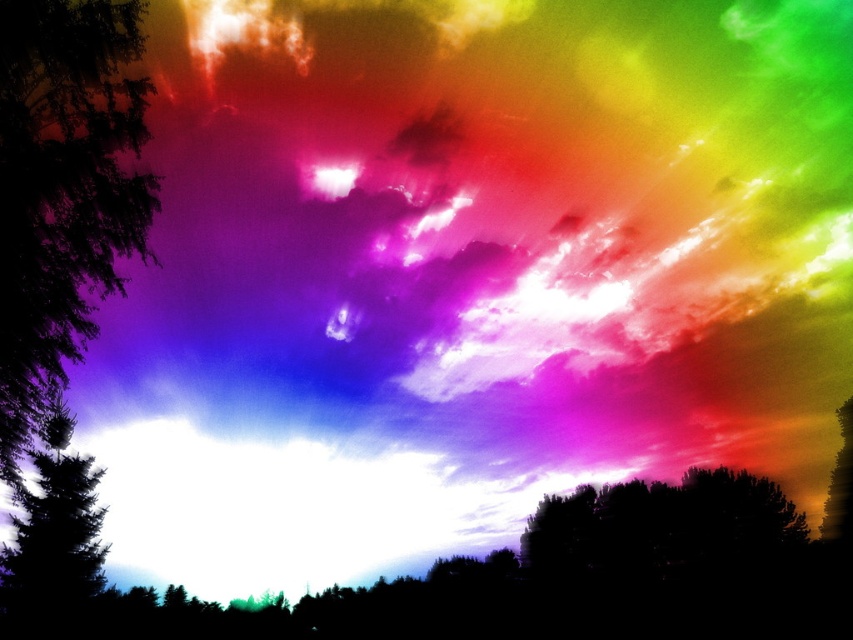
Does silhouette leafy tree at left have a greater height compared to dark green textured tree at left?

Yes.

Between point (84, 17) and point (102, 580), which one is positioned behind?

Positioned behind is point (102, 580).

Which is in front, point (9, 70) or point (21, 540)?

Positioned in front is point (9, 70).

Find the location of a particular element. The height and width of the screenshot is (640, 853). silhouette leafy tree at left is located at coordinates (62, 192).